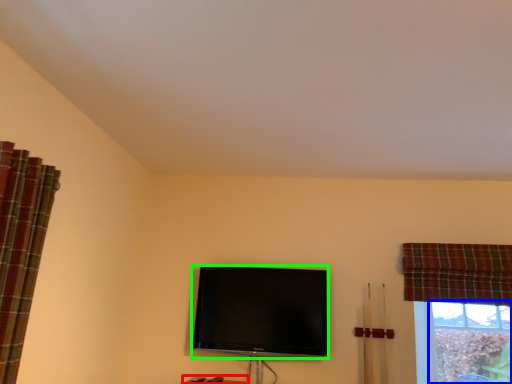
Question: Which object is positioned farthest from furniture (highlighted by a red box)? Select from bay window (highlighted by a blue box) and television (highlighted by a green box).

Choices:
 (A) bay window
 (B) television

Answer: (A)